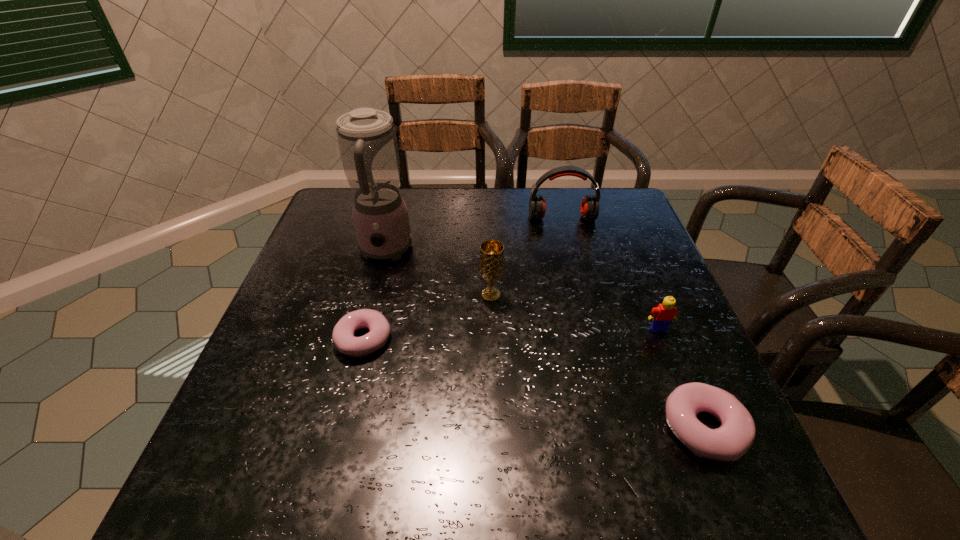
Find the location of a particular element. vacant space located 0.330m on the back of the shorter doughnut is located at coordinates (391, 233).

Find the location of `free space located 0.100m on the left of the taller doughnut`. free space located 0.100m on the left of the taller doughnut is located at coordinates (609, 429).

Identify the location of vacant area situated 0.100m on the ear cups of the farthest object. The image size is (960, 540). (568, 245).

Where is `vacant space situated on the front-facing side of the Lego`? vacant space situated on the front-facing side of the Lego is located at coordinates (696, 424).

Identify the location of vacant point located 0.140m on the base of the tallest object near the control knob. The width and height of the screenshot is (960, 540). (370, 314).

Find the location of a particular element. This screenshot has height=540, width=960. blank area located on the left of the fourth object from right to left is located at coordinates (330, 295).

Locate an element on the screen. This screenshot has width=960, height=540. earphone situated at the far edge is located at coordinates (589, 209).

Find the location of `food processor present at the far edge`. food processor present at the far edge is located at coordinates (367, 141).

Find the location of a particular element. object that is at the near edge is located at coordinates (729, 442).

Image resolution: width=960 pixels, height=540 pixels. In order to click on doughnut present at the left edge in this screenshot , I will do `click(343, 339)`.